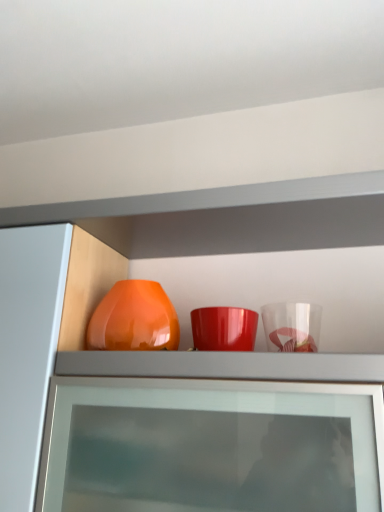
Question: Is matte orange vase at center beside glossy orange vase at center?

Choices:
 (A) no
 (B) yes

Answer: (A)

Question: Is matte orange vase at center wider than glossy orange vase at center?

Choices:
 (A) yes
 (B) no

Answer: (A)

Question: Is matte orange vase at center taller than glossy orange vase at center?

Choices:
 (A) no
 (B) yes

Answer: (B)

Question: Is matte orange vase at center further to camera compared to glossy orange vase at center?

Choices:
 (A) no
 (B) yes

Answer: (A)

Question: Is glossy orange vase at center completely or partially inside matte orange vase at center?

Choices:
 (A) yes
 (B) no

Answer: (A)

Question: From the image's perspective, is matte orange vase at center beneath glossy orange vase at center?

Choices:
 (A) no
 (B) yes

Answer: (B)

Question: Is glossy orange vase at center wider than matte orange vase at center?

Choices:
 (A) no
 (B) yes

Answer: (A)

Question: Are glossy orange vase at center and matte orange vase at center far apart?

Choices:
 (A) no
 (B) yes

Answer: (A)

Question: From the image's perspective, is glossy orange vase at center on matte orange vase at center?

Choices:
 (A) no
 (B) yes

Answer: (B)

Question: Does glossy orange vase at center have a lesser width compared to matte orange vase at center?

Choices:
 (A) no
 (B) yes

Answer: (B)

Question: Can you see glossy orange vase at center touching matte orange vase at center?

Choices:
 (A) yes
 (B) no

Answer: (B)

Question: Is the depth of glossy orange vase at center less than that of matte orange vase at center?

Choices:
 (A) yes
 (B) no

Answer: (B)

Question: Would you say glossy orange vase at center is inside or outside matte orange vase at center?

Choices:
 (A) outside
 (B) inside

Answer: (B)